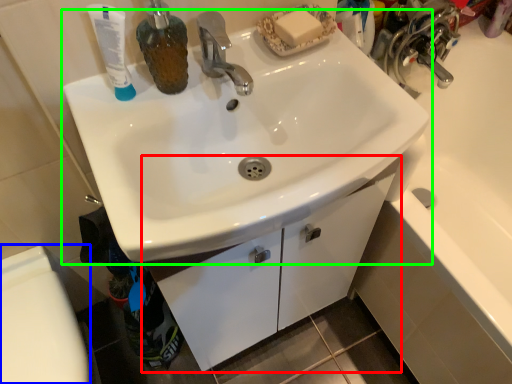
Question: Which object is positioned closest to bathroom cabinet (highlighted by a red box)? Select from toilet bowl (highlighted by a blue box) and sink (highlighted by a green box).

Choices:
 (A) toilet bowl
 (B) sink

Answer: (B)